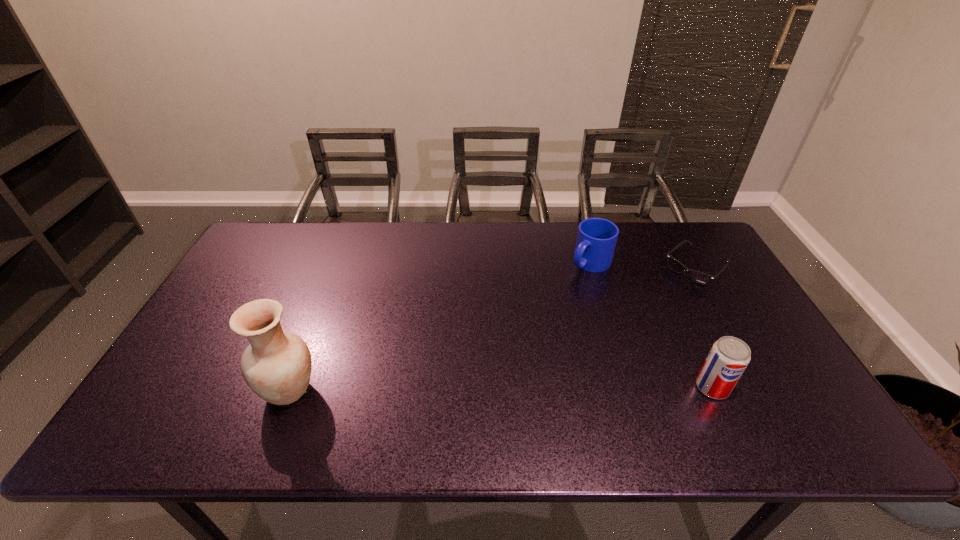
Where is `the tallest object`? The width and height of the screenshot is (960, 540). the tallest object is located at coordinates (277, 365).

Locate an element on the screen. This screenshot has width=960, height=540. pottery is located at coordinates (277, 365).

You are a GUI agent. You are given a task and a screenshot of the screen. Output one action in this format:
    pyautogui.click(x=<x>, y=<y>)
    Task: Click on the soda
    This screenshot has height=540, width=960.
    Given the screenshot: What is the action you would take?
    pyautogui.click(x=729, y=356)

This screenshot has width=960, height=540. Find the location of `the third tallest object`. the third tallest object is located at coordinates (596, 240).

The height and width of the screenshot is (540, 960). What are the coordinates of `mug` in the screenshot? It's located at (596, 240).

Where is `sunglasses`? The image size is (960, 540). sunglasses is located at coordinates (698, 277).

Find the location of `free space located 0.240m on the back of the leftmost object`. free space located 0.240m on the back of the leftmost object is located at coordinates (324, 299).

The image size is (960, 540). In order to click on vacant area situated 0.320m on the left of the soda in this screenshot , I will do `click(563, 387)`.

Find the location of a particular element. Image resolution: width=960 pixels, height=540 pixels. free space located on the side with the handle of the third object from right to left is located at coordinates (543, 303).

The width and height of the screenshot is (960, 540). I want to click on free space located on the side with the handle of the third object from right to left, so click(x=501, y=341).